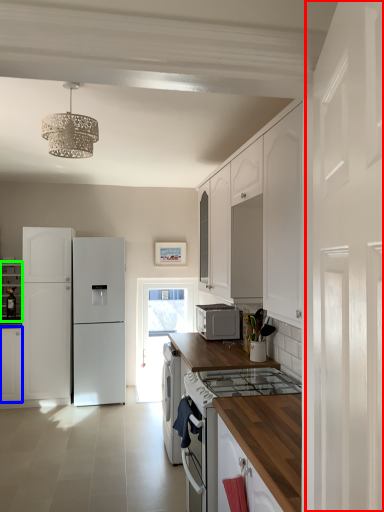
Question: Which object is the closest to the side (highlighted by a red box)? Choose among these: cabinetry (highlighted by a blue box) or cabinetry (highlighted by a green box).

Choices:
 (A) cabinetry
 (B) cabinetry

Answer: (A)